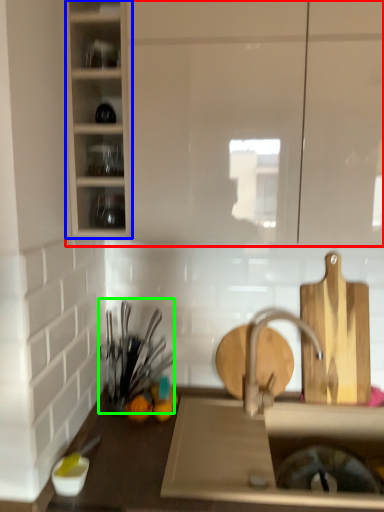
Question: Which object is positioned farthest from cabinetry (highlighted by a red box)? Select from cabinetry (highlighted by a blue box) and tableware (highlighted by a green box).

Choices:
 (A) cabinetry
 (B) tableware

Answer: (B)